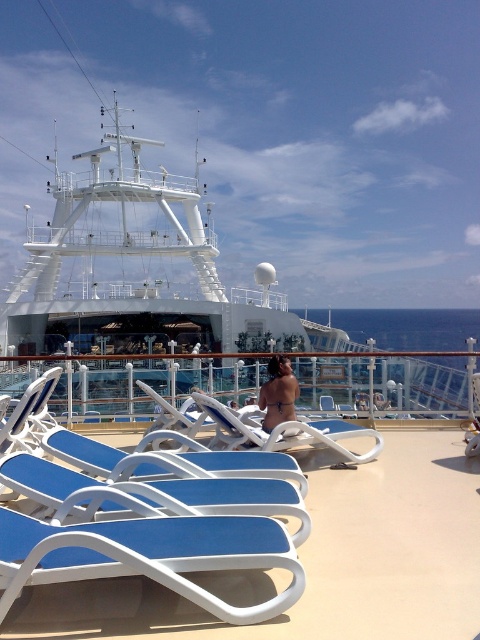
Question: Which point is farther to the camera?

Choices:
 (A) (224, 422)
 (B) (212, 520)
 (C) (284, 387)

Answer: (C)

Question: Can you confirm if white plastic rail at center is smaller than blue plastic beach chair at center?

Choices:
 (A) yes
 (B) no

Answer: (B)

Question: Which object is the closest to the blue plastic beach chair at lower left?

Choices:
 (A) white plastic rail at center
 (B) white glossy boat at upper center
 (C) smooth tan skin at center
 (D) blue plastic lounge chair at lower left

Answer: (D)

Question: In this image, where is white glossy boat at upper center located relative to smooth tan skin at center?

Choices:
 (A) left
 (B) right

Answer: (A)

Question: Can you confirm if white glossy boat at upper center is bigger than blue plastic beach chair at center?

Choices:
 (A) yes
 (B) no

Answer: (A)

Question: Which object is closer to the camera taking this photo?

Choices:
 (A) white plastic rail at center
 (B) blue plastic beach chair at lower left
 (C) blue plastic lounge chair at lower left
 (D) smooth tan skin at center

Answer: (C)